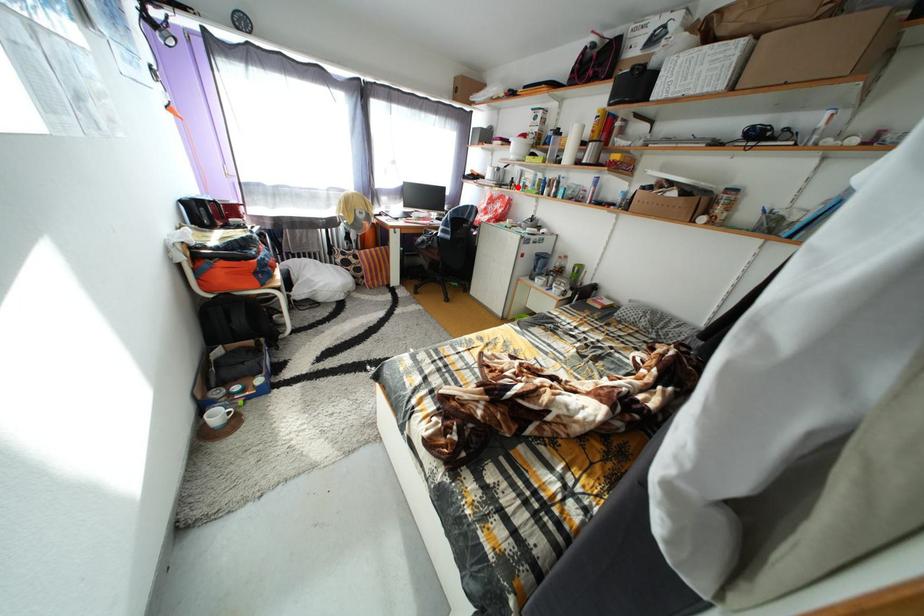
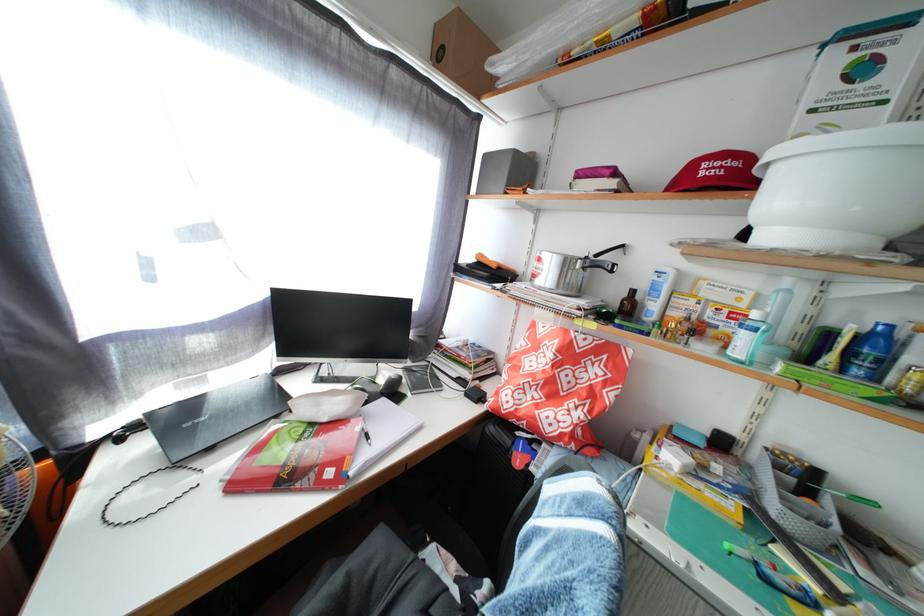
Question: I am providing you with two images of the same scene from different viewpoints. A red point is shown in image1. For the corresponding object point in image2, is it positioned nearer or farther from the camera?

Choices:
 (A) Nearer
 (B) Farther

Answer: (B)